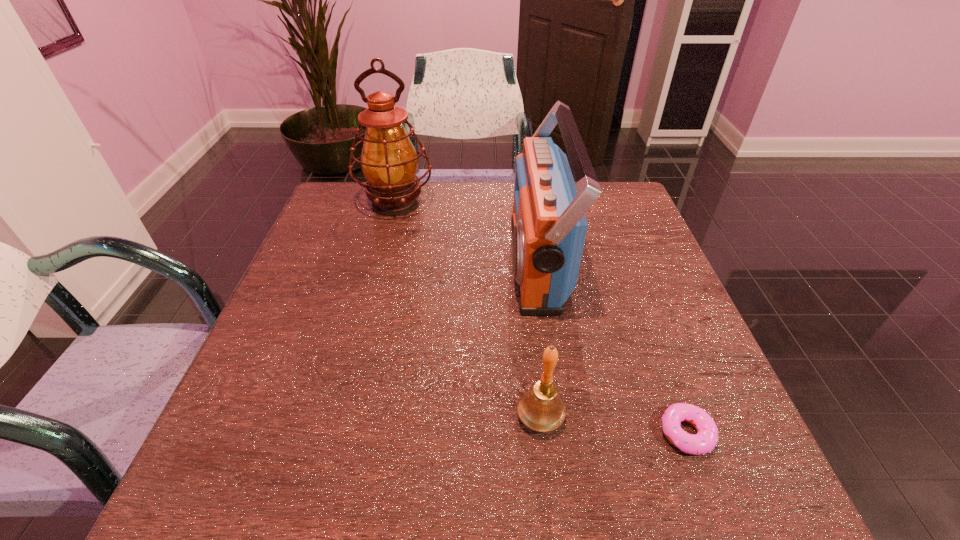
You are a GUI agent. You are given a task and a screenshot of the screen. Output one action in this format:
    pyautogui.click(x=<x>, y=<y>)
    Task: Click on the oil lamp
    The width and height of the screenshot is (960, 540).
    Given the screenshot: What is the action you would take?
    click(389, 161)

Find the location of a particular element. the tallest object is located at coordinates (389, 161).

This screenshot has width=960, height=540. I want to click on the third shortest object, so click(x=549, y=226).

You are a GUI agent. You are given a task and a screenshot of the screen. Output one action in this format:
    pyautogui.click(x=<x>, y=<y>)
    Task: Click on the bell
    
    Given the screenshot: What is the action you would take?
    pyautogui.click(x=541, y=409)

The image size is (960, 540). In order to click on doughnut in this screenshot , I will do `click(706, 439)`.

The height and width of the screenshot is (540, 960). I want to click on the rightmost object, so click(x=706, y=439).

Where is `free space located 0.330m on the right of the leftmost object`? This screenshot has height=540, width=960. free space located 0.330m on the right of the leftmost object is located at coordinates (548, 204).

The image size is (960, 540). I want to click on vacant space located on the front-facing side of the radio receiver, so click(441, 262).

The image size is (960, 540). What are the coordinates of `vacant space situated on the front-facing side of the radio receiver` in the screenshot? It's located at (461, 262).

Locate an element on the screen. The width and height of the screenshot is (960, 540). free space located 0.230m on the front-facing side of the radio receiver is located at coordinates 417,262.